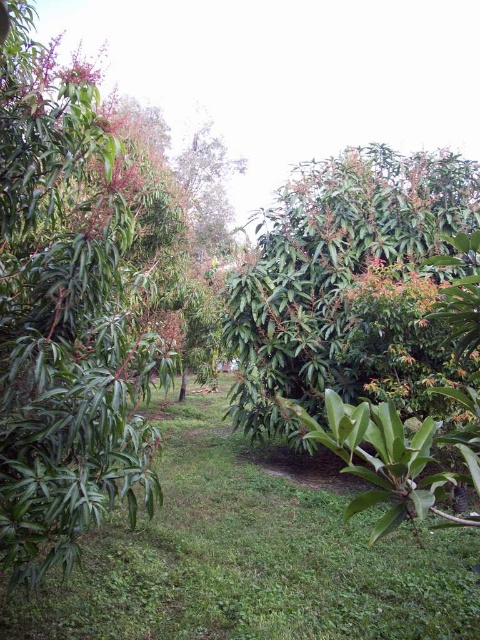
Based on the photo, which is more to the left, green grass at center or green glossy tree at center?

green grass at center is more to the left.

Which is above, green grass at center or green glossy tree at center?

green glossy tree at center

Between point (340, 582) and point (385, 348), which one is positioned in front?

Positioned in front is point (340, 582).

At what (x,y) coordinates should I click in order to perform the action: click on green grass at center. Please return your answer as a coordinate pair (x, y). Looking at the image, I should click on (251, 560).

Does green glossy leafy tree at left have a smaller size compared to green glossy tree at center?

Correct, green glossy leafy tree at left occupies less space than green glossy tree at center.

Is point (96, 326) behind point (272, 256)?

That is False.

Find the location of a particular element. Image resolution: width=480 pixels, height=640 pixels. green glossy leafy tree at left is located at coordinates (66, 324).

Does green glossy leafy tree at left appear over green grass at center?

Yes.

Is green glossy leafy tree at left further to camera compared to green grass at center?

That is False.

Between point (62, 248) and point (215, 493), which one is positioned behind?

Point (215, 493)

This screenshot has width=480, height=640. What are the coordinates of `green glossy leafy tree at left` in the screenshot? It's located at (66, 324).